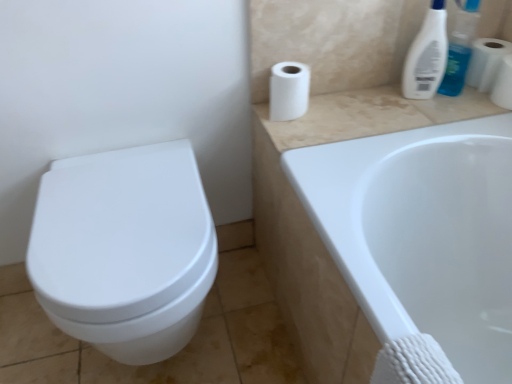
Question: From a real-world perspective, is white glossy toilet at left positioned under beige marble counter top at upper right based on gravity?

Choices:
 (A) no
 (B) yes

Answer: (B)

Question: Does white glossy toilet at left come behind beige marble counter top at upper right?

Choices:
 (A) yes
 (B) no

Answer: (B)

Question: Is white glossy toilet at left positioned beyond the bounds of beige marble counter top at upper right?

Choices:
 (A) yes
 (B) no

Answer: (A)

Question: Does white glossy toilet at left have a lesser height compared to beige marble counter top at upper right?

Choices:
 (A) no
 (B) yes

Answer: (A)

Question: Is white glossy toilet at left far away from beige marble counter top at upper right?

Choices:
 (A) yes
 (B) no

Answer: (B)

Question: From the image's perspective, is white glossy toilet at left located beneath beige marble counter top at upper right?

Choices:
 (A) yes
 (B) no

Answer: (A)

Question: Does white matte toilet paper at upper right, which ranks as the 2th toilet paper in right-to-left order, contain white matte toilet paper at upper right, which is the 1th toilet paper in left-to-right order?

Choices:
 (A) no
 (B) yes

Answer: (A)

Question: From a real-world perspective, is white matte toilet paper at upper right, the 2th toilet paper from the left, positioned under white matte toilet paper at upper right, acting as the 3th toilet paper starting from the right, based on gravity?

Choices:
 (A) yes
 (B) no

Answer: (B)

Question: Considering the relative sizes of white matte toilet paper at upper right, which ranks as the 2th toilet paper in right-to-left order, and white matte toilet paper at upper right, acting as the 3th toilet paper starting from the right, in the image provided, is white matte toilet paper at upper right, which ranks as the 2th toilet paper in right-to-left order, bigger than white matte toilet paper at upper right, acting as the 3th toilet paper starting from the right,?

Choices:
 (A) no
 (B) yes

Answer: (A)

Question: Is white matte toilet paper at upper right, which ranks as the 2th toilet paper in right-to-left order, smaller than white matte toilet paper at upper right, which is the 1th toilet paper in left-to-right order?

Choices:
 (A) yes
 (B) no

Answer: (A)

Question: Are white matte toilet paper at upper right, which ranks as the 2th toilet paper in right-to-left order, and white matte toilet paper at upper right, which is the 1th toilet paper in left-to-right order, far apart?

Choices:
 (A) yes
 (B) no

Answer: (B)

Question: Is white matte toilet paper at upper right, which ranks as the 2th toilet paper in right-to-left order, behind white matte toilet paper at upper right, acting as the 3th toilet paper starting from the right?

Choices:
 (A) yes
 (B) no

Answer: (A)

Question: Is white matte toilet paper at upper right, which is the 1th toilet paper in left-to-right order, at the left side of white glossy toilet at left?

Choices:
 (A) no
 (B) yes

Answer: (A)